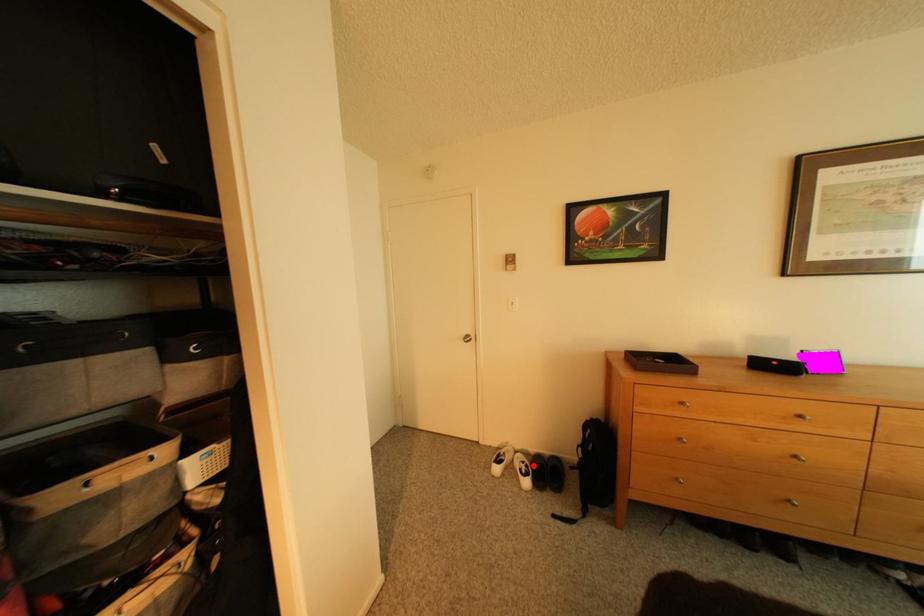
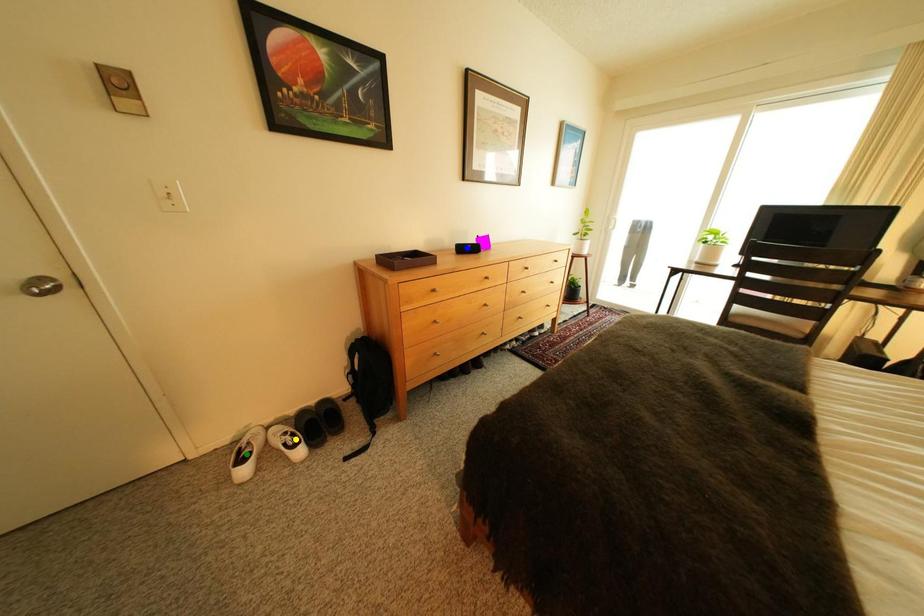
Question: I am providing you with two images of the same scene from different viewpoints. A red point is marked on the first image. You are given multiple points on the second image. Can you choose the point in image 2 that corresponds to the point in image 1?

Choices:
 (A) blue point
 (B) yellow point
 (C) green point

Answer: (B)